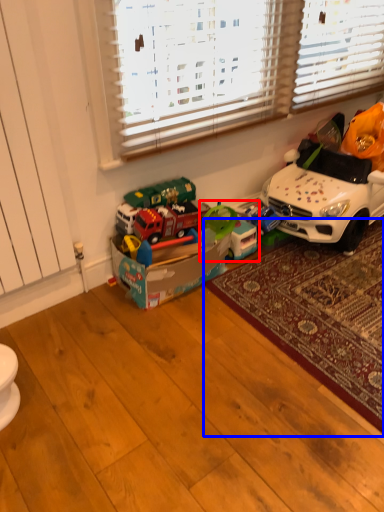
Question: Which of the following is the farthest to the observer, toy (highlighted by a red box) or mat (highlighted by a blue box)?

Choices:
 (A) toy
 (B) mat

Answer: (A)